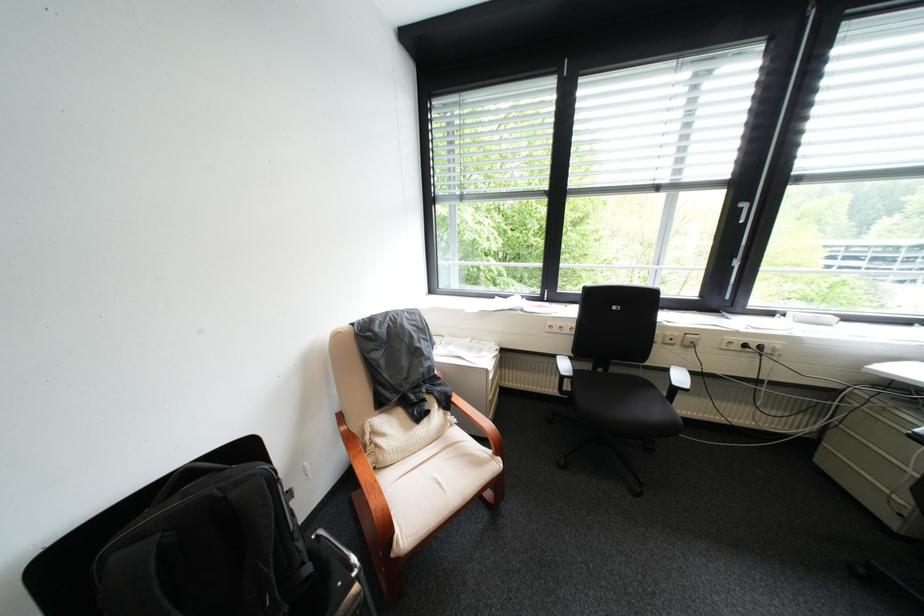
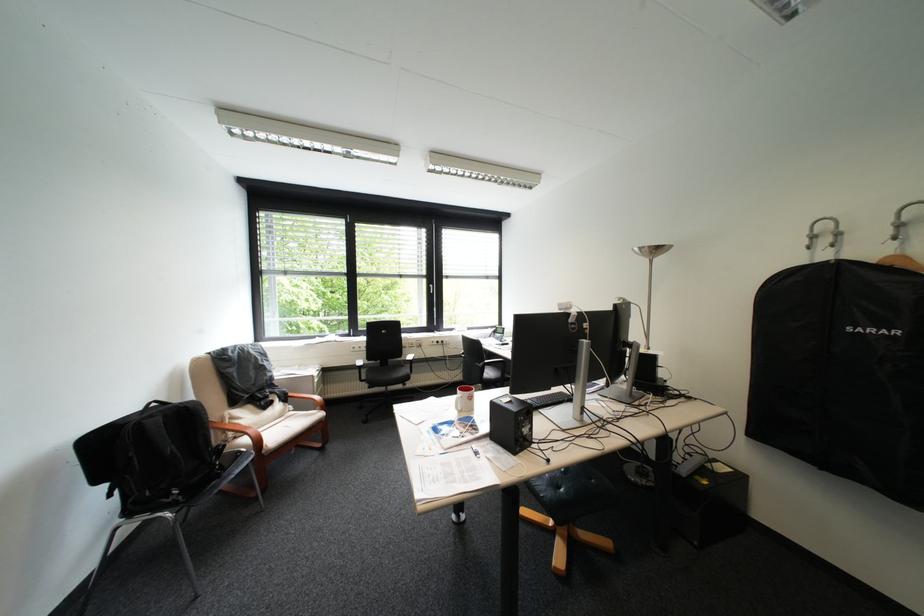
In the second image, find the point that corresponds to pixel 435 374 in the first image.

(280, 381)